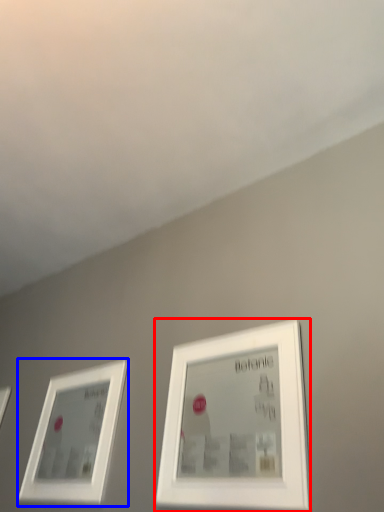
Question: Which point is closer to the camera, picture frame (highlighted by a red box) or picture frame (highlighted by a blue box)?

Choices:
 (A) picture frame
 (B) picture frame

Answer: (A)